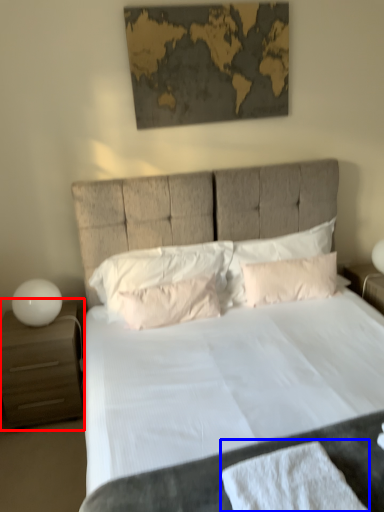
Question: Among these objects, which one is farthest to the camera, nightstand (highlighted by a red box) or bath towel (highlighted by a blue box)?

Choices:
 (A) nightstand
 (B) bath towel

Answer: (A)